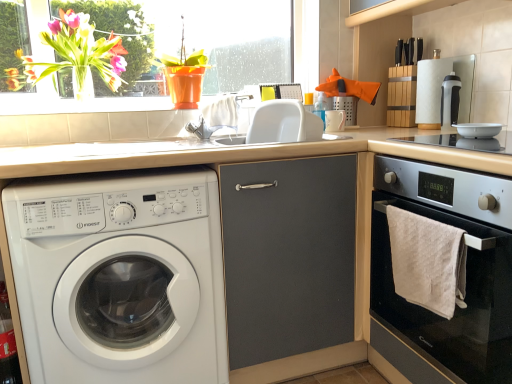
Image resolution: width=512 pixels, height=384 pixels. What do you see at coordinates (478, 130) in the screenshot?
I see `white glossy bowl at upper right` at bounding box center [478, 130].

Identify the location of black glass oven at right. (466, 275).

This screenshot has height=384, width=512. Describe the element at coordinates (466, 275) in the screenshot. I see `black glass oven at right` at that location.

Image resolution: width=512 pixels, height=384 pixels. What do you see at coordinates (288, 256) in the screenshot?
I see `matte gray cabinet at center` at bounding box center [288, 256].

Describe the element at coordinates (228, 39) in the screenshot. This screenshot has width=512, height=384. I see `transparent glass window at upper left` at that location.

Describe the element at coordinates (280, 124) in the screenshot. I see `white plastic sink at center` at that location.

What is the approximate height of white plastic sink at center?

8.65 inches.

Find the location of a particular element. This screenshot has height=384, width=512. black plastic coffee machine at upper right is located at coordinates (450, 100).

Is white textured towel at lower right far away from translucent glass vase at upper left?

Yes, white textured towel at lower right is far from translucent glass vase at upper left.

Which is correct: white textured towel at lower right is inside translucent glass vase at upper left, or outside of it?

white textured towel at lower right is outside translucent glass vase at upper left.

Based on the photo, from the image's perspective, is white textured towel at lower right positioned above or below translucent glass vase at upper left?

white textured towel at lower right is situated lower than translucent glass vase at upper left in the image.

How far apart are white textured towel at lower right and translucent glass vase at upper left?

white textured towel at lower right is 4.36 feet away from translucent glass vase at upper left.

Is point (443, 186) positioned behind point (468, 129)?

No, (443, 186) is in front of (468, 129).

You are a GUI agent. You are given a task and a screenshot of the screen. Output one action in this format:
    pyautogui.click(x=<x>, y=<y>)
    Task: Click on the oven on the right of white glossy bowl at upper right
    
    Given the screenshot: What is the action you would take?
    pyautogui.click(x=466, y=275)

Considering the sizes of objects black glass oven at right and white glossy bowl at upper right in the image provided, who is smaller, black glass oven at right or white glossy bowl at upper right?

white glossy bowl at upper right is smaller.

Is white plastic washing machine at left beside white glossy bowl at upper right?

They are not placed beside each other.

From a real-world perspective, which is physically below, white plastic washing machine at left or white glossy bowl at upper right?

white plastic washing machine at left, from a real-world perspective.

Does matte gray cabinet at center have a greater height compared to translucent glass vase at upper left?

Correct, matte gray cabinet at center is much taller as translucent glass vase at upper left.

How far apart are matte gray cabinet at center and translucent glass vase at upper left?

matte gray cabinet at center is 36.99 inches away from translucent glass vase at upper left.

Considering the relative sizes of matte gray cabinet at center and translucent glass vase at upper left in the image provided, is matte gray cabinet at center bigger than translucent glass vase at upper left?

Indeed, matte gray cabinet at center has a larger size compared to translucent glass vase at upper left.

Considering the points (255, 200) and (124, 82), which point is behind, point (255, 200) or point (124, 82)?

The point (124, 82) is farther.

Is white glossy bowl at upper right wider than black plastic coffee machine at upper right?

Yes, white glossy bowl at upper right is wider than black plastic coffee machine at upper right.

Is black plastic coffee machine at upper right surrounded by white glossy bowl at upper right?

No, black plastic coffee machine at upper right is not a part of white glossy bowl at upper right.

Based on the photo, from a real-world perspective, is white glossy bowl at upper right physically located above or below black plastic coffee machine at upper right?

In terms of real-world spatial position, white glossy bowl at upper right is below black plastic coffee machine at upper right.

Which of these two, white glossy bowl at upper right or black plastic coffee machine at upper right, stands taller?

black plastic coffee machine at upper right is taller.

Is white plastic washing machine at left in front of or behind white textured towel at lower right in the image?

white plastic washing machine at left is behind white textured towel at lower right.

From a real-world perspective, who is located higher, white plastic washing machine at left or white textured towel at lower right?

In real-world perspective, white textured towel at lower right is above.

Can you confirm if white plastic washing machine at left is thinner than white textured towel at lower right?

No.

In the image, is white plastic washing machine at left on the left side or the right side of white textured towel at lower right?

In the image, white plastic washing machine at left appears on the left side of white textured towel at lower right.

In terms of height, does clear glass wine bottle at lower left look taller or shorter compared to black glass oven at right?

Considering their sizes, clear glass wine bottle at lower left has less height than black glass oven at right.

Is clear glass wine bottle at lower left far from black glass oven at right?

Yes, clear glass wine bottle at lower left is far from black glass oven at right.

Where is `oven in front of the clear glass wine bottle at lower left`? oven in front of the clear glass wine bottle at lower left is located at coordinates 466,275.

The height and width of the screenshot is (384, 512). In the image, there is a white textured towel at lower right. In order to click on flower above it (from the image's perspective) in this screenshot , I will do `click(75, 55)`.

I want to click on appliance lying on the left of black glass oven at right, so click(x=478, y=130).

Based on their spatial positions, is matte gray cabinet at center or black glass oven at right further from white plastic sink at center?

Among the two, black glass oven at right is located further to white plastic sink at center.

Which object lies nearer to the anchor point transparent glass window at upper left, clear glass wine bottle at lower left or white plastic sink at center?

Among the two, white plastic sink at center is located nearer to transparent glass window at upper left.

Looking at the image, which one is located closer to translucent glass vase at upper left, white textured towel at lower right or white plastic washing machine at left?

white plastic washing machine at left lies closer to translucent glass vase at upper left than the other object.

Estimate the real-world distances between objects in this image. Which object is closer to black plastic coffee machine at upper right, black glass oven at right or white plastic washing machine at left?

black glass oven at right.

Considering their positions, is clear glass wine bottle at lower left positioned closer to black plastic coffee machine at upper right than matte gray cabinet at center?

matte gray cabinet at center is closer to black plastic coffee machine at upper right.

Considering their positions, is beige laminate countertop at center positioned further to clear glass wine bottle at lower left than transparent glass window at upper left?

transparent glass window at upper left lies further to clear glass wine bottle at lower left than the other object.

Considering their positions, is white glossy bowl at upper right positioned closer to black glass oven at right than matte gray cabinet at center?

Among the two, matte gray cabinet at center is located nearer to black glass oven at right.

Consider the image. Estimate the real-world distances between objects in this image. Which object is closer to white plastic washing machine at left, black glass oven at right or matte gray cabinet at center?

matte gray cabinet at center lies closer to white plastic washing machine at left than the other object.

Locate an element on the screen. The height and width of the screenshot is (384, 512). washing machine between clear glass wine bottle at lower left and matte gray cabinet at center in the horizontal direction is located at coordinates (120, 276).

Locate an element on the screen. washing machine that lies between transparent glass window at upper left and clear glass wine bottle at lower left from top to bottom is located at coordinates (120, 276).

At what (x,y) coordinates should I click in order to perform the action: click on countertop between transparent glass window at upper left and white glossy bowl at upper right in the horizontal direction. Please return your answer as a coordinate pair (x, y). This screenshot has height=384, width=512. Looking at the image, I should click on (255, 160).

This screenshot has width=512, height=384. I want to click on countertop located between transparent glass window at upper left and black glass oven at right in the left-right direction, so click(255, 160).